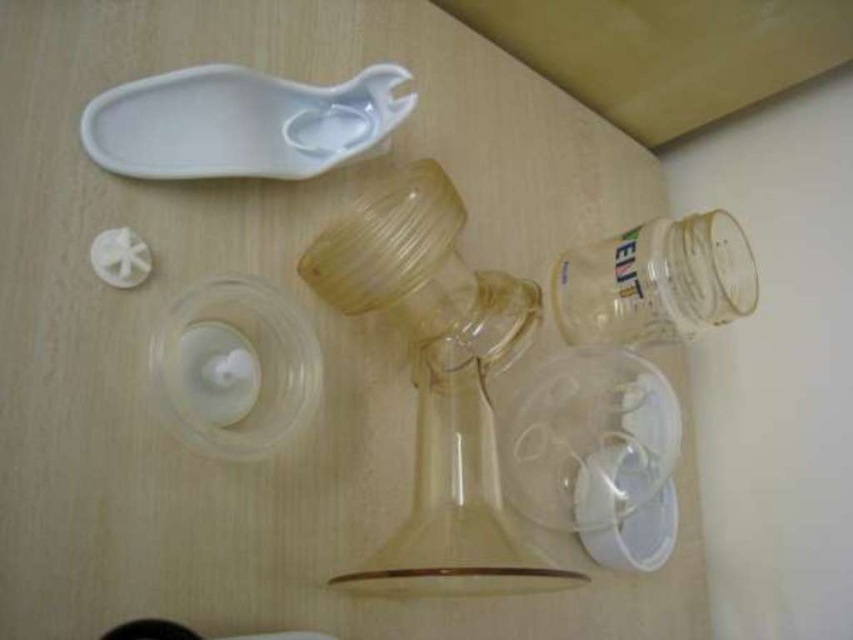
You are setting up a small floral arrangement on a table. You have a translucent plastic glass vase at center and a transparent plastic jar at lower right. Which container should you choose if you want to hold a bouquet with longer stems?

The translucent plastic glass vase at center is taller than the transparent plastic jar at lower right, so you should choose the translucent plastic glass vase at center to hold the bouquet with longer stems.

You are organizing a craft project and need to place the translucent plastic glass vase at center and the transparent plastic jar at lower right on a shelf. According to the image, which one should you place first to ensure proper alignment?

The translucent plastic glass vase at center should be placed first because it is positioned on the left side of the transparent plastic jar at lower right, so placing it first ensures proper alignment.

You are organizing a display of these items and want to place the translucent plastic glass vase at center and the transparent plastic jar at lower right. Which item is closer to the viewer?

The translucent plastic glass vase at center is closer to the viewer because it is in front of the transparent plastic jar at lower right.